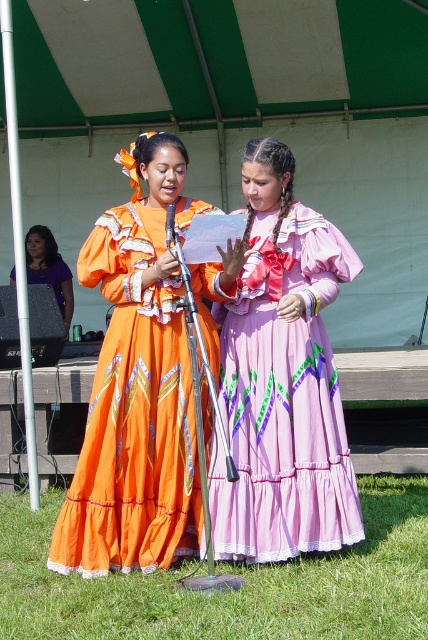
You are standing in front of the image and notice a point marked at coordinates (136, 387). Which object from the scene is located exactly at that point?

The matte orange dress at center is located exactly at point (136, 387).

You are planning to take a photo of the matte orange dress at center and the pink dress at lower right. Given their positions in the image, which dress should you focus on first if you want to capture them both in a single frame without moving the camera?

The matte orange dress at center is located at point (136, 387), so you should focus on the matte orange dress at center first as it is closer to the center of the image, ensuring both dresses are in frame.

You are standing at the center of the image and want to walk towards the two points marked in the scene. Which point, point (128, 483) or point (193, 605), will you reach first?

Point (193, 605) will be reached first because it is closer to the observer than point (128, 483), which is positioned behind it.